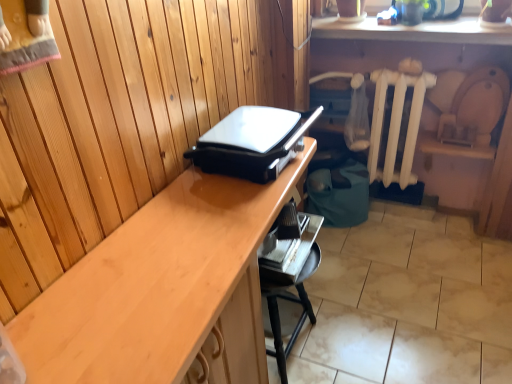
Where is `free space on the front side of black plastic grill at center`? free space on the front side of black plastic grill at center is located at coordinates (214, 222).